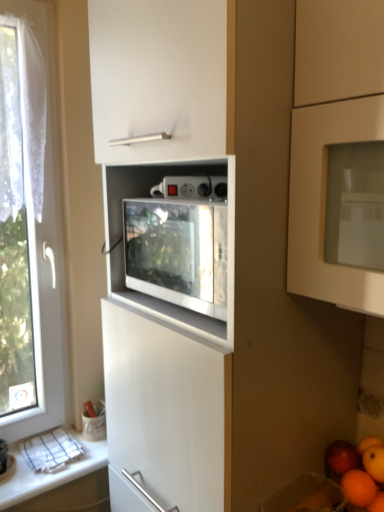
Describe the element at coordinates (357, 468) in the screenshot. I see `smooth orange at lower right` at that location.

You are a GUI agent. You are given a task and a screenshot of the screen. Output one action in this format:
    pyautogui.click(x=<x>, y=<y>)
    Task: Click on the orange matte at lower right, arranged as the 1th orange when viewed from the top
    
    Given the screenshot: What is the action you would take?
    pyautogui.click(x=374, y=462)

Between orange matte at lower right, which is the first orange from bottom to top, and red matte apple at lower right, which one has smaller width?

orange matte at lower right, which is the first orange from bottom to top.

Based on the photo, in the image, is orange matte at lower right, which is the first orange from bottom to top, positioned in front of or behind red matte apple at lower right?

Visually, orange matte at lower right, which is the first orange from bottom to top, is located in front of red matte apple at lower right.

Looking at this image, considering the sizes of orange matte at lower right, which is the first orange from bottom to top, and red matte apple at lower right in the image, is orange matte at lower right, which is the first orange from bottom to top, bigger or smaller than red matte apple at lower right?

Clearly, orange matte at lower right, which is the first orange from bottom to top, is larger in size than red matte apple at lower right.

From a real-world perspective, between orange matte at lower right, the second orange in the top-to-bottom sequence, and red matte apple at lower right, who is vertically higher?

red matte apple at lower right is physically above.

Based on the photo, visually, is red matte apple at lower right positioned to the left or to the right of white glossy countertop at lower left?

Clearly, red matte apple at lower right is on the right of white glossy countertop at lower left in the image.

What's the angular difference between red matte apple at lower right and white glossy countertop at lower left's facing directions?

There is a 90.7-degree angle between the facing directions of red matte apple at lower right and white glossy countertop at lower left.

Locate an element on the screen. countertop below the red matte apple at lower right (from the image's perspective) is located at coordinates (47, 473).

Can you confirm if orange matte at lower right, the second orange in the top-to-bottom sequence, is wider than smooth orange at lower right?

No.

Is orange matte at lower right, which is the first orange from bottom to top, situated inside smooth orange at lower right or outside?

Answer: orange matte at lower right, which is the first orange from bottom to top, is not inside smooth orange at lower right, it's outside.

From a real-world perspective, is orange matte at lower right, the second orange in the top-to-bottom sequence, beneath smooth orange at lower right?

Yes, from a real-world perspective, orange matte at lower right, the second orange in the top-to-bottom sequence, is below smooth orange at lower right.

From the image's perspective, which one is positioned lower, white glossy countertop at lower left or red matte apple at lower right?

white glossy countertop at lower left appears lower in the image.

Does white glossy countertop at lower left have a larger size compared to red matte apple at lower right?

Yes.

Is white glossy countertop at lower left shorter than red matte apple at lower right?

Indeed, white glossy countertop at lower left has a lesser height compared to red matte apple at lower right.

How many degrees apart are the facing directions of white glossy countertop at lower left and red matte apple at lower right?

The angle between the facing direction of white glossy countertop at lower left and the facing direction of red matte apple at lower right is 90.7 degrees.

In the scene shown: From the image's perspective, would you say transparent fabric at left is positioned over smooth orange at lower right?

Yes, from the image's perspective, transparent fabric at left is above smooth orange at lower right.

Is transparent fabric at left not close to smooth orange at lower right?

No, transparent fabric at left is not far from smooth orange at lower right.

Between transparent fabric at left and smooth orange at lower right, which one is positioned behind?

transparent fabric at left is further from the camera.

What's the angular difference between transparent fabric at left and smooth orange at lower right's facing directions?

There is a 90.6-degree angle between the facing directions of transparent fabric at left and smooth orange at lower right.

Considering their positions, is orange matte at lower right, arranged as the 1th orange when viewed from the top, located in front of or behind orange matte at lower right, the second orange in the top-to-bottom sequence?

In the image, orange matte at lower right, arranged as the 1th orange when viewed from the top, appears behind orange matte at lower right, the second orange in the top-to-bottom sequence.

From the image's perspective, between orange matte at lower right, arranged as the 1th orange when viewed from the top, and orange matte at lower right, the second orange in the top-to-bottom sequence, who is located below?

orange matte at lower right, the second orange in the top-to-bottom sequence, from the image's perspective.

Is orange matte at lower right, arranged as the 1th orange when viewed from the top, oriented away from orange matte at lower right, which is the first orange from bottom to top?

That's not correct — orange matte at lower right, arranged as the 1th orange when viewed from the top, is not looking away from orange matte at lower right, which is the first orange from bottom to top.

How different are the orientations of orange matte at lower right, positioned as the second orange in bottom-to-top order, and transparent fabric at left in degrees?

There is a 90.6-degree angle between the facing directions of orange matte at lower right, positioned as the second orange in bottom-to-top order, and transparent fabric at left.

Between orange matte at lower right, arranged as the 1th orange when viewed from the top, and transparent fabric at left, which one is positioned behind?

transparent fabric at left is more distant.

From a real-world perspective, is orange matte at lower right, arranged as the 1th orange when viewed from the top, on top of transparent fabric at left?

No.

Visually, is orange matte at lower right, positioned as the second orange in bottom-to-top order, positioned to the left or to the right of transparent fabric at left?

From the image, it's evident that orange matte at lower right, positioned as the second orange in bottom-to-top order, is to the right of transparent fabric at left.

This screenshot has width=384, height=512. Find the location of `apple behind the orange matte at lower right, which is the first orange from bottom to top`. apple behind the orange matte at lower right, which is the first orange from bottom to top is located at coordinates [342, 457].

Identify the location of countertop lying below the red matte apple at lower right (from the image's perspective). (47, 473).

Based on their spatial positions, is orange matte at lower right, arranged as the 1th orange when viewed from the top, or orange matte at lower right, which is the first orange from bottom to top, closer to transparent fabric at left?

The object closer to transparent fabric at left is orange matte at lower right, arranged as the 1th orange when viewed from the top.

Looking at the image, which one is located further to orange matte at lower right, positioned as the second orange in bottom-to-top order, red matte apple at lower right or transparent fabric at left?

transparent fabric at left lies further to orange matte at lower right, positioned as the second orange in bottom-to-top order, than the other object.

In the scene shown: Estimate the real-world distances between objects in this image. Which object is further from red matte apple at lower right, transparent fabric at left or white glossy countertop at lower left?

Among the two, transparent fabric at left is located further to red matte apple at lower right.

From the image, which object appears to be farther from orange matte at lower right, the second orange in the top-to-bottom sequence, orange matte at lower right, positioned as the second orange in bottom-to-top order, or red matte apple at lower right?

red matte apple at lower right lies further to orange matte at lower right, the second orange in the top-to-bottom sequence, than the other object.

From the image, which object appears to be farther from white glossy countertop at lower left, smooth orange at lower right or transparent fabric at left?

Among the two, smooth orange at lower right is located further to white glossy countertop at lower left.

When comparing their distances from smooth orange at lower right, does red matte apple at lower right or orange matte at lower right, the second orange in the top-to-bottom sequence, seem further?

orange matte at lower right, the second orange in the top-to-bottom sequence, is positioned further to the anchor smooth orange at lower right.

Considering their positions, is orange matte at lower right, positioned as the second orange in bottom-to-top order, positioned closer to white glossy countertop at lower left than orange matte at lower right, the second orange in the top-to-bottom sequence?

The object closer to white glossy countertop at lower left is orange matte at lower right, positioned as the second orange in bottom-to-top order.

When comparing their distances from red matte apple at lower right, does orange matte at lower right, which is the first orange from bottom to top, or transparent fabric at left seem closer?

orange matte at lower right, which is the first orange from bottom to top.

In order to click on apple situated between transparent fabric at left and smooth orange at lower right from left to right in this screenshot , I will do `click(342, 457)`.

The image size is (384, 512). Identify the location of fruit situated between white glossy countertop at lower left and orange matte at lower right, positioned as the second orange in bottom-to-top order, from left to right. (357, 468).

At what (x,y) coordinates should I click in order to perform the action: click on fruit situated between transparent fabric at left and orange matte at lower right, which is the first orange from bottom to top, from left to right. Please return your answer as a coordinate pair (x, y). Looking at the image, I should click on (357, 468).

You are a GUI agent. You are given a task and a screenshot of the screen. Output one action in this format:
    pyautogui.click(x=<x>, y=<y>)
    Task: Click on the countertop between transparent fabric at left and orange matte at lower right, arranged as the 1th orange when viewed from the top
    The height and width of the screenshot is (512, 384).
    Given the screenshot: What is the action you would take?
    pyautogui.click(x=47, y=473)